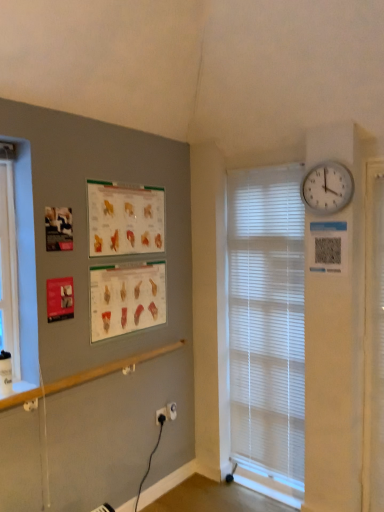
Locate an element on the screen. The height and width of the screenshot is (512, 384). matte paper poster at center left, which appears as the first poster page when ordered from the bottom is located at coordinates (126, 298).

The image size is (384, 512). In order to click on white plastic wall clock at upper right in this screenshot , I will do `click(327, 188)`.

The height and width of the screenshot is (512, 384). What do you see at coordinates (8, 270) in the screenshot?
I see `white plastic bay window at left` at bounding box center [8, 270].

Find the location of a particular element. The height and width of the screenshot is (512, 384). matte paper poster at center left, the first poster page positioned from the top is located at coordinates (125, 219).

Can matte paper poster at center left, which appears as the 2th poster page when ordered from the bottom, be found inside white plastic wall clock at upper right?

No, matte paper poster at center left, which appears as the 2th poster page when ordered from the bottom, is not inside white plastic wall clock at upper right.

Is the surface of white plastic wall clock at upper right in direct contact with matte paper poster at center left, the first poster page positioned from the top?

There is a gap between white plastic wall clock at upper right and matte paper poster at center left, the first poster page positioned from the top.

Is white plastic wall clock at upper right wider or thinner than matte paper poster at center left, the first poster page positioned from the top?

Considering their sizes, white plastic wall clock at upper right looks broader than matte paper poster at center left, the first poster page positioned from the top.

In the scene shown: How many degrees apart are the facing directions of white plastic wall clock at upper right and matte paper poster at center left, the first poster page positioned from the top?

The facing directions of white plastic wall clock at upper right and matte paper poster at center left, the first poster page positioned from the top, are 87.5 degrees apart.

Considering the relative positions of white plastic bay window at left and matte paper poster at center left, the first poster page positioned from the top, in the image provided, is white plastic bay window at left to the right of matte paper poster at center left, the first poster page positioned from the top, from the viewer's perspective?

Incorrect, white plastic bay window at left is not on the right side of matte paper poster at center left, the first poster page positioned from the top.

Is white plastic bay window at left next to matte paper poster at center left, which appears as the 2th poster page when ordered from the bottom?

There is a gap between white plastic bay window at left and matte paper poster at center left, which appears as the 2th poster page when ordered from the bottom.

The width and height of the screenshot is (384, 512). I want to click on poster page that is the 1st object to the right of the white plastic bay window at left, starting at the anchor, so click(125, 219).

Locate an element on the screen. Image resolution: width=384 pixels, height=512 pixels. poster page that is the 1st one when counting forward from the white plastic blinds at center is located at coordinates (126, 298).

Who is shorter, white plastic blinds at center or matte paper poster at center left, marked as the 2th poster page in a top-to-bottom arrangement?

matte paper poster at center left, marked as the 2th poster page in a top-to-bottom arrangement, is shorter.

Does white plastic blinds at center appear on the left side of matte paper poster at center left, marked as the 2th poster page in a top-to-bottom arrangement?

No, white plastic blinds at center is not to the left of matte paper poster at center left, marked as the 2th poster page in a top-to-bottom arrangement.

Is matte paper poster at center left, which appears as the first poster page when ordered from the bottom, inside white plastic blinds at center?

No, matte paper poster at center left, which appears as the first poster page when ordered from the bottom, is not surrounded by white plastic blinds at center.

Between point (303, 182) and point (8, 221), which one is positioned in front?

The point (8, 221) is in front.

How different are the orientations of white plastic wall clock at upper right and white plastic bay window at left in degrees?

The angle between the facing direction of white plastic wall clock at upper right and the facing direction of white plastic bay window at left is 87.5 degrees.

Which of these two, white plastic wall clock at upper right or white plastic bay window at left, is smaller?

white plastic wall clock at upper right is smaller.

Locate an element on the screen. poster page above the matte paper poster at center left, marked as the 2th poster page in a top-to-bottom arrangement (from a real-world perspective) is located at coordinates (125, 219).

Is matte paper poster at center left, marked as the 2th poster page in a top-to-bottom arrangement, turned away from matte paper poster at center left, the first poster page positioned from the top?

No, matte paper poster at center left, marked as the 2th poster page in a top-to-bottom arrangement, is not facing away from matte paper poster at center left, the first poster page positioned from the top.

Which is in front, point (107, 318) or point (99, 242)?

Point (99, 242)

You are a GUI agent. You are given a task and a screenshot of the screen. Output one action in this format:
    pyautogui.click(x=<x>, y=<y>)
    Task: Click on the wall clock on the right side of white plastic bay window at left
    This screenshot has width=384, height=512.
    Given the screenshot: What is the action you would take?
    pyautogui.click(x=327, y=188)

Which object is thinner, white plastic bay window at left or white plastic wall clock at upper right?

With smaller width is white plastic wall clock at upper right.

Is point (14, 236) positioned behind point (306, 199)?

No, (14, 236) is in front of (306, 199).

Considering the positions of objects white plastic bay window at left and white plastic wall clock at upper right in the image provided, who is in front, white plastic bay window at left or white plastic wall clock at upper right?

white plastic bay window at left is more forward.

Is white plastic wall clock at upper right a part of white plastic blinds at center?

No, white plastic wall clock at upper right is not inside white plastic blinds at center.

From the picture: Would you say white plastic blinds at center is a long distance from white plastic wall clock at upper right?

That's not correct — white plastic blinds at center is a little close to white plastic wall clock at upper right.

Based on the photo, from the image's perspective, is white plastic blinds at center over white plastic wall clock at upper right?

Actually, white plastic blinds at center appears below white plastic wall clock at upper right in the image.

Which of these two, white plastic blinds at center or white plastic wall clock at upper right, stands shorter?

white plastic wall clock at upper right.

Where is `poster page that is the 1st one when counting backward from the white plastic wall clock at upper right`? The width and height of the screenshot is (384, 512). poster page that is the 1st one when counting backward from the white plastic wall clock at upper right is located at coordinates (125, 219).

Find the location of a particular element. poster page above the white plastic bay window at left (from a real-world perspective) is located at coordinates click(125, 219).

Estimate the real-world distances between objects in this image. Which object is further from white plastic electric outlet at lower center, matte paper poster at center left, which appears as the first poster page when ordered from the bottom, or white plastic wall clock at upper right?

white plastic wall clock at upper right is further to white plastic electric outlet at lower center.

When comparing their distances from white plastic blinds at center, does matte paper poster at center left, which appears as the 2th poster page when ordered from the bottom, or white plastic electric outlet at lower center seem closer?

Based on the image, matte paper poster at center left, which appears as the 2th poster page when ordered from the bottom, appears to be nearer to white plastic blinds at center.

From the image, which object appears to be farther from matte paper poster at center left, marked as the 2th poster page in a top-to-bottom arrangement, white plastic electric outlet at lower center or white plastic wall clock at upper right?

Based on the image, white plastic wall clock at upper right appears to be further to matte paper poster at center left, marked as the 2th poster page in a top-to-bottom arrangement.

Estimate the real-world distances between objects in this image. Which object is closer to white plastic blinds at center, white plastic bay window at left or matte paper poster at center left, marked as the 2th poster page in a top-to-bottom arrangement?

matte paper poster at center left, marked as the 2th poster page in a top-to-bottom arrangement, is closer to white plastic blinds at center.

Which object lies nearer to the anchor point white plastic electric outlet at lower center, white plastic blinds at center or matte paper poster at center left, marked as the 2th poster page in a top-to-bottom arrangement?

The object closer to white plastic electric outlet at lower center is matte paper poster at center left, marked as the 2th poster page in a top-to-bottom arrangement.

When comparing their distances from white plastic bay window at left, does white plastic blinds at center or matte paper poster at center left, which appears as the 2th poster page when ordered from the bottom, seem further?

white plastic blinds at center.

Looking at the image, which one is located further to white plastic wall clock at upper right, white plastic bay window at left or matte paper poster at center left, the first poster page positioned from the top?

The object further to white plastic wall clock at upper right is white plastic bay window at left.

Considering their positions, is matte paper poster at center left, which appears as the 2th poster page when ordered from the bottom, positioned closer to white plastic wall clock at upper right than white plastic blinds at center?

The object closer to white plastic wall clock at upper right is white plastic blinds at center.

Where is `electric outlet located between white plastic bay window at left and white plastic wall clock at upper right in the left-right direction`? The image size is (384, 512). electric outlet located between white plastic bay window at left and white plastic wall clock at upper right in the left-right direction is located at coordinates (171, 411).

Find the location of a particular element. bay window that lies between matte paper poster at center left, the first poster page positioned from the top, and white plastic electric outlet at lower center from top to bottom is located at coordinates (8, 270).

You are a GUI agent. You are given a task and a screenshot of the screen. Output one action in this format:
    pyautogui.click(x=<x>, y=<y>)
    Task: Click on the window blind between matte paper poster at center left, the first poster page positioned from the top, and white plastic wall clock at upper right, in the horizontal direction
    
    Given the screenshot: What is the action you would take?
    pyautogui.click(x=267, y=320)

Locate an element on the screen. window blind between matte paper poster at center left, which appears as the first poster page when ordered from the bottom, and white plastic wall clock at upper right, in the horizontal direction is located at coordinates (267, 320).